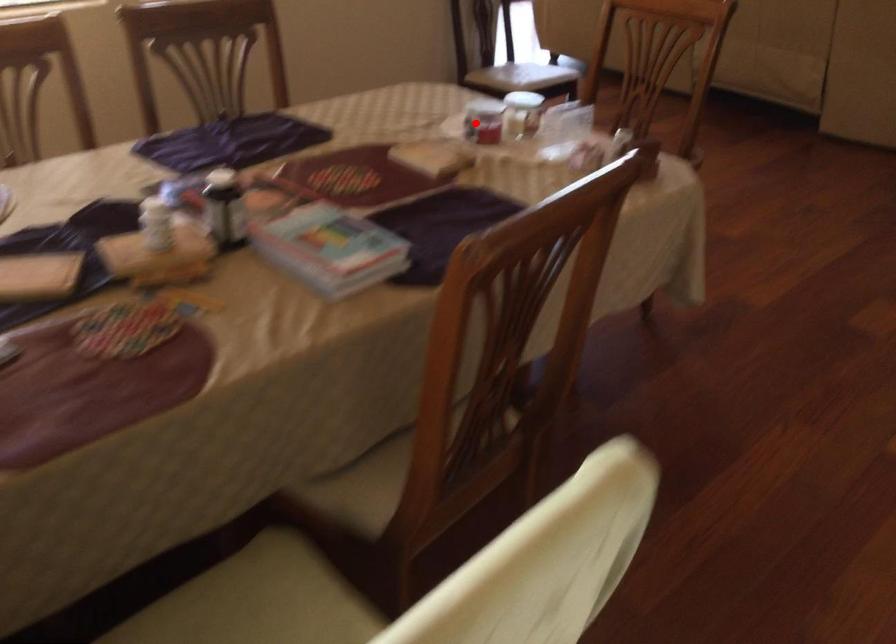
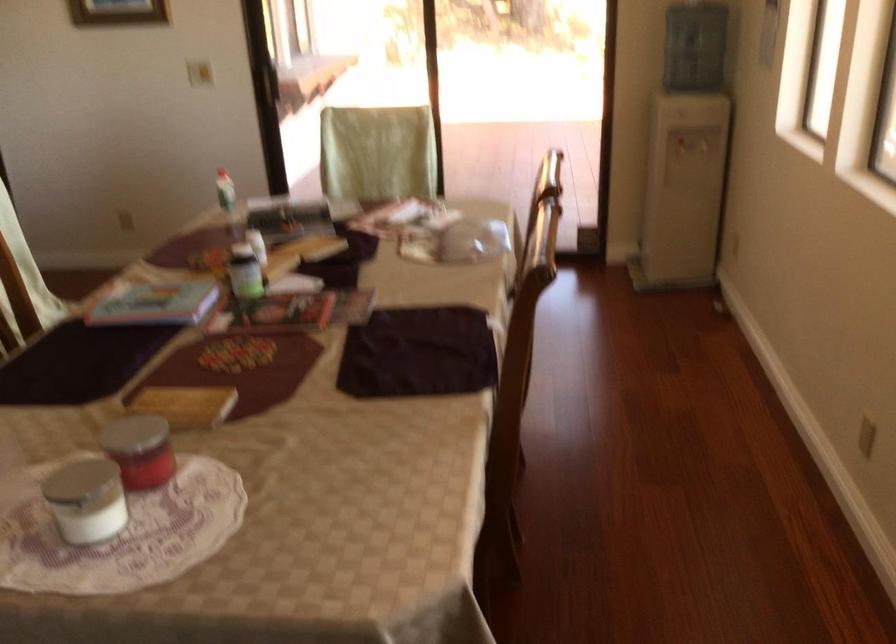
Where in the second image is the point corresponding to the highlighted location from the first image?

(162, 465)